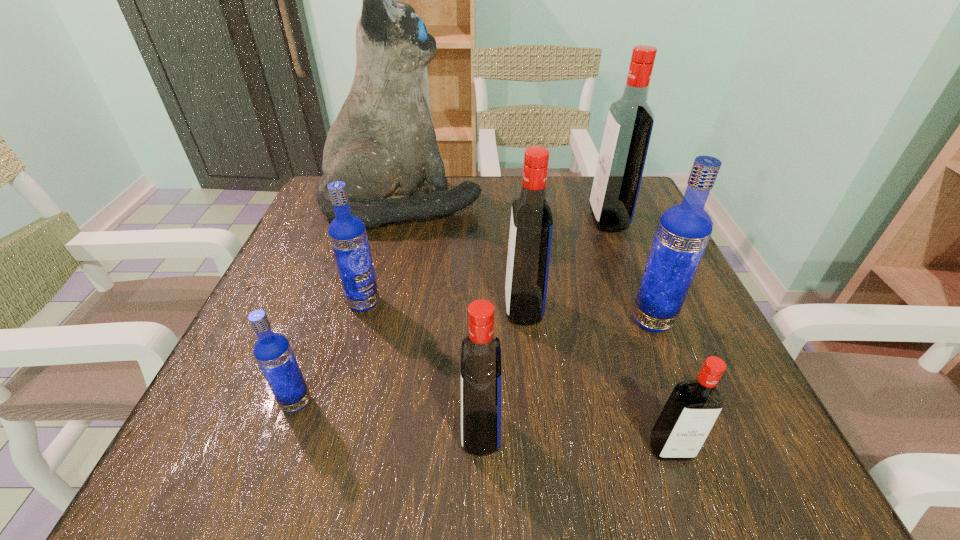
Where is `free space between the leftmost red vodka and the seventh shortest object`? free space between the leftmost red vodka and the seventh shortest object is located at coordinates (544, 326).

Locate an element on the screen. vacant point located between the fourth vodka from left to right and the smallest red vodka is located at coordinates (597, 379).

In order to click on free space between the leftmost vodka and the leftmost red vodka in this screenshot , I will do `click(389, 417)`.

Locate an element on the screen. The image size is (960, 540). free point between the fifth object from left to right and the fifth vodka from right to left is located at coordinates tap(502, 370).

Where is `the sixth closest object to the nearest blue vodka`? The image size is (960, 540). the sixth closest object to the nearest blue vodka is located at coordinates (683, 232).

Image resolution: width=960 pixels, height=540 pixels. Find the location of `object that is the fourth closest to the third biggest red vodka`. object that is the fourth closest to the third biggest red vodka is located at coordinates (347, 233).

Where is `vodka that stands as the fifth closest to the third vodka from left to right`? This screenshot has height=540, width=960. vodka that stands as the fifth closest to the third vodka from left to right is located at coordinates (683, 232).

Locate an element on the screen. This screenshot has height=540, width=960. vodka that stands as the fourth closest to the second blue vodka from right to left is located at coordinates (683, 232).

You are a GUI agent. You are given a task and a screenshot of the screen. Output one action in this format:
    pyautogui.click(x=<x>, y=<y>)
    Task: Click on the red vodka that is the third nearest to the second tallest object
    This screenshot has height=540, width=960.
    Given the screenshot: What is the action you would take?
    pyautogui.click(x=481, y=353)

This screenshot has height=540, width=960. I want to click on red vodka that can be found as the closest to the smallest blue vodka, so click(x=481, y=353).